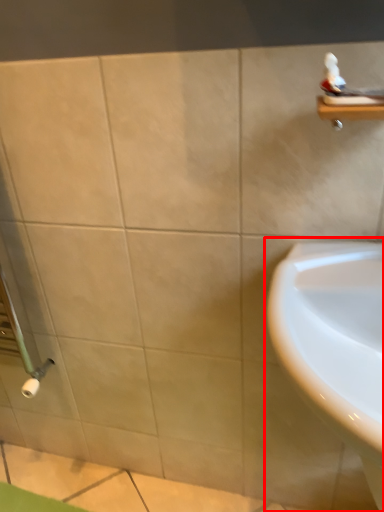
Question: From the image's perspective, where is sink (annotated by the red box) located relative to balustrade?

Choices:
 (A) above
 (B) below

Answer: (B)